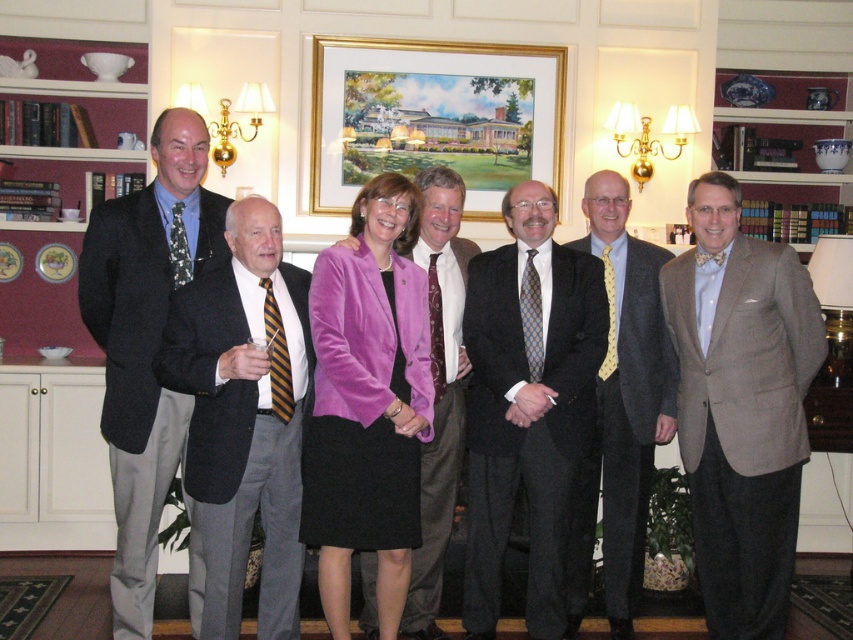
Can you confirm if matte black suit at center is positioned to the right of blue dotted tie at center?

Correct, you'll find matte black suit at center to the right of blue dotted tie at center.

Can you confirm if matte black suit at center is taller than blue dotted tie at center?

Indeed, matte black suit at center has a greater height compared to blue dotted tie at center.

Which is behind, point (639, 497) or point (521, 316)?

Positioned behind is point (639, 497).

Find the location of a particular element. matte black suit at center is located at coordinates (621, 406).

Measure the distance from purple velvet blazer at center to blue dotted tie at center.

purple velvet blazer at center is 25.39 inches away from blue dotted tie at center.

Between purple velvet blazer at center and blue dotted tie at center, which one appears on the right side from the viewer's perspective?

From the viewer's perspective, blue dotted tie at center appears more on the right side.

What do you see at coordinates (367, 403) in the screenshot?
I see `purple velvet blazer at center` at bounding box center [367, 403].

Locate an element on the screen. This screenshot has width=853, height=640. purple velvet blazer at center is located at coordinates (367, 403).

Between black satin suit at center and gold-framed painting at upper center, which one appears on the left side from the viewer's perspective?

black satin suit at center

Does black satin suit at center appear under gold-framed painting at upper center?

Yes, black satin suit at center is below gold-framed painting at upper center.

Which is behind, point (248, 227) or point (339, 99)?

The point (339, 99) is more distant.

Where is `black satin suit at center`? The width and height of the screenshot is (853, 640). black satin suit at center is located at coordinates (244, 417).